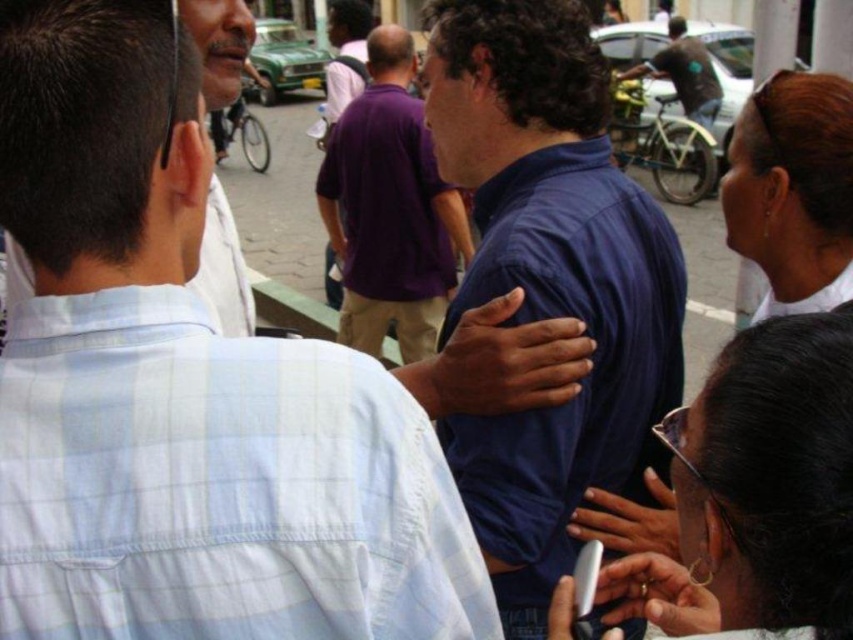
Question: Can you confirm if blue shirt at center is positioned below light blue plaid shirt at upper left?

Choices:
 (A) no
 (B) yes

Answer: (B)

Question: Which point is farther to the camera?

Choices:
 (A) light blue plaid shirt at upper left
 (B) blue cotton shirt at center

Answer: (B)

Question: Which of the following is the closest to the observer?

Choices:
 (A) (386, 212)
 (B) (244, 58)

Answer: (B)

Question: Is blue cotton shirt at center above dark blue shirt at center?

Choices:
 (A) no
 (B) yes

Answer: (A)

Question: Can you confirm if blue cotton shirt at center is smaller than dark blue shirt at center?

Choices:
 (A) yes
 (B) no

Answer: (A)

Question: Which object is the closest to the dark blue shirt at upper right?

Choices:
 (A) dark blue shirt at center
 (B) blue shirt at center

Answer: (A)